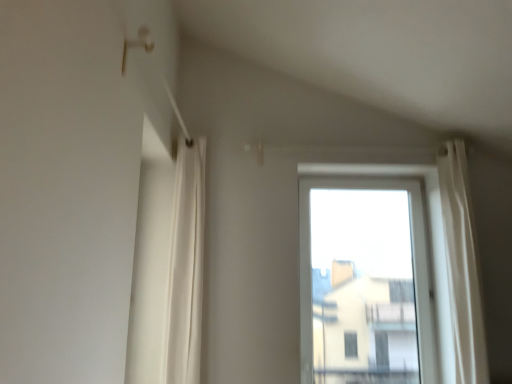
Question: Considering the positions of point (203, 208) and point (425, 355), is point (203, 208) closer or farther from the camera than point (425, 355)?

Choices:
 (A) closer
 (B) farther

Answer: (A)

Question: From a real-world perspective, is white fabric curtain at left positioned above or below transparent glass window at center?

Choices:
 (A) above
 (B) below

Answer: (A)

Question: Relative to transparent glass window at center, is white fabric curtain at left in front or behind?

Choices:
 (A) front
 (B) behind

Answer: (A)

Question: From a real-world perspective, is transparent glass window at center above or below white fabric curtain at left?

Choices:
 (A) above
 (B) below

Answer: (B)

Question: Is transparent glass window at center in front of or behind white fabric curtain at left in the image?

Choices:
 (A) front
 (B) behind

Answer: (B)

Question: Considering the positions of point (395, 182) and point (169, 365), is point (395, 182) closer or farther from the camera than point (169, 365)?

Choices:
 (A) closer
 (B) farther

Answer: (B)

Question: Considering the positions of transparent glass window at center and white fabric curtain at left in the image, is transparent glass window at center wider or thinner than white fabric curtain at left?

Choices:
 (A) wide
 (B) thin

Answer: (B)